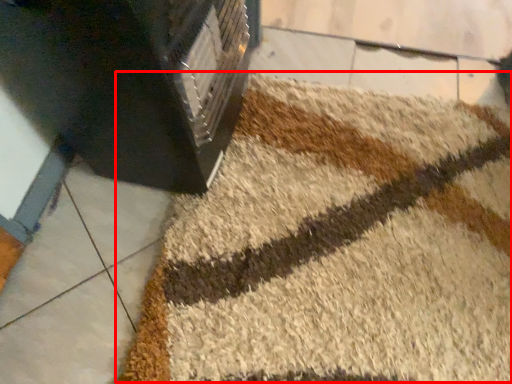
Question: From the image's perspective, where is bath mat (annotated by the red box) located relative to furniture?

Choices:
 (A) above
 (B) below

Answer: (B)